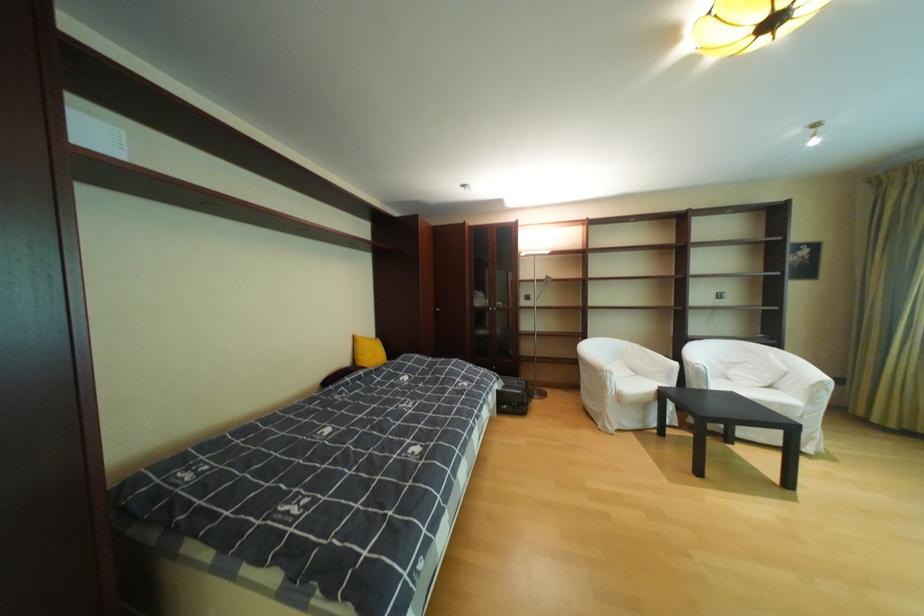
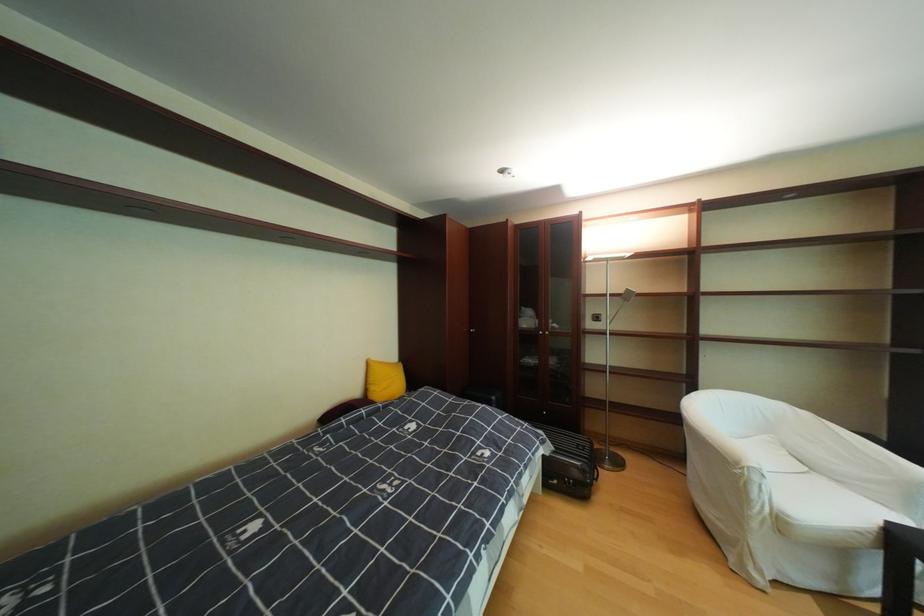
Where in the second image is the point corresponding to (550,282) from the first image?

(624, 296)